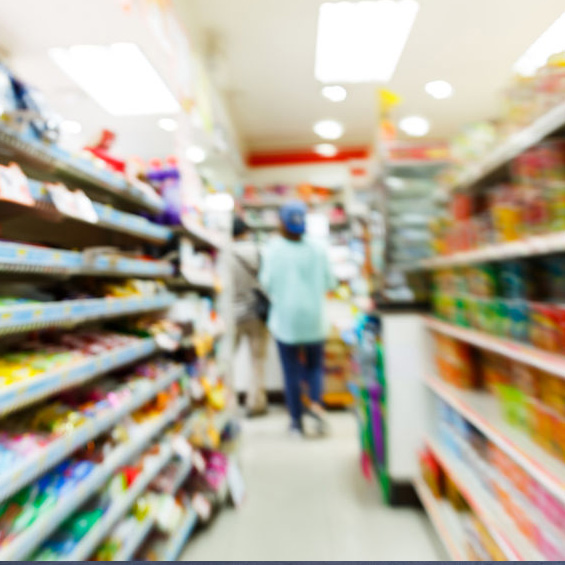
You are a GUI agent. You are given a task and a screenshot of the screen. Output one action in this format:
    pyautogui.click(x=<x>, y=<y>)
    Task: Click on the lights
    The height and width of the screenshot is (565, 565).
    Given the screenshot: What is the action you would take?
    pyautogui.click(x=341, y=28), pyautogui.click(x=128, y=95), pyautogui.click(x=543, y=47)